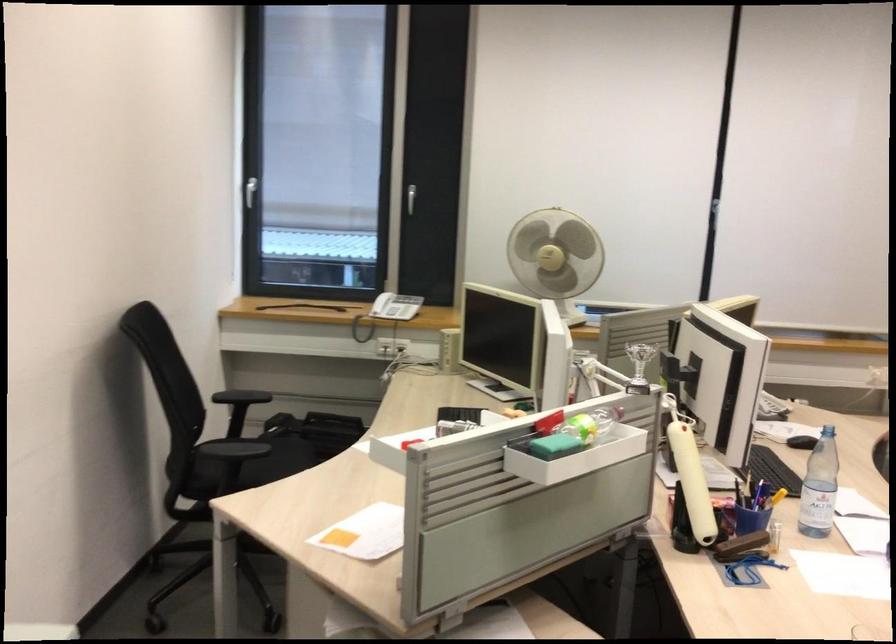
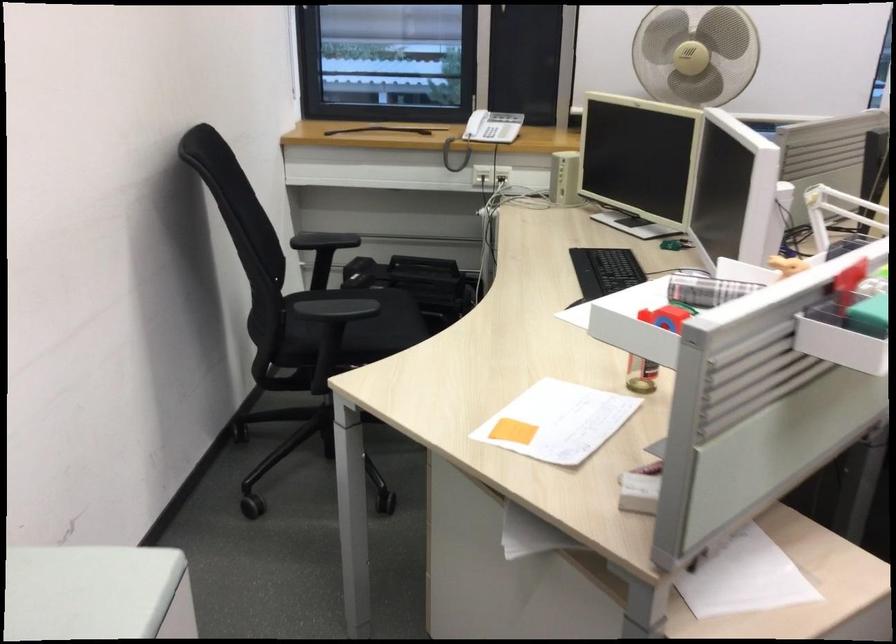
In a continuous first-person perspective shot, in which direction is the camera moving?

The cameraman moved toward left, forward.